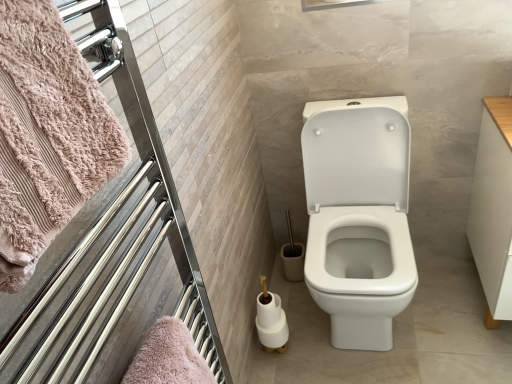
Question: Which direction should I rotate to look at white glossy toilet paper at lower center, which is counted as the first toilet paper, starting from the bottom?

Choices:
 (A) right
 (B) left

Answer: (A)

Question: Can pink fluffy towel at left be found inside chrome metallic towel rack at upper left?

Choices:
 (A) yes
 (B) no

Answer: (A)

Question: Is chrome metallic towel rack at upper left facing away from pink fluffy towel at left?

Choices:
 (A) no
 (B) yes

Answer: (B)

Question: Considering the relative sizes of chrome metallic towel rack at upper left and pink fluffy towel at left in the image provided, is chrome metallic towel rack at upper left smaller than pink fluffy towel at left?

Choices:
 (A) yes
 (B) no

Answer: (B)

Question: Is chrome metallic towel rack at upper left further to camera compared to pink fluffy towel at left?

Choices:
 (A) yes
 (B) no

Answer: (A)

Question: Considering the relative sizes of chrome metallic towel rack at upper left and pink fluffy towel at left in the image provided, is chrome metallic towel rack at upper left thinner than pink fluffy towel at left?

Choices:
 (A) no
 (B) yes

Answer: (B)

Question: Considering the relative sizes of chrome metallic towel rack at upper left and pink fluffy towel at left in the image provided, is chrome metallic towel rack at upper left taller than pink fluffy towel at left?

Choices:
 (A) no
 (B) yes

Answer: (B)

Question: From a real-world perspective, is pink fluffy towel at left physically above chrome metallic towel rack at upper left?

Choices:
 (A) no
 (B) yes

Answer: (B)

Question: Considering the relative sizes of pink fluffy towel at left and chrome metallic towel rack at upper left in the image provided, is pink fluffy towel at left wider than chrome metallic towel rack at upper left?

Choices:
 (A) yes
 (B) no

Answer: (A)

Question: Can you confirm if pink fluffy towel at left is taller than chrome metallic towel rack at upper left?

Choices:
 (A) no
 (B) yes

Answer: (A)

Question: From the image's perspective, is pink fluffy towel at left located beneath chrome metallic towel rack at upper left?

Choices:
 (A) yes
 (B) no

Answer: (B)

Question: Is chrome metallic towel rack at upper left at the back of pink fluffy towel at left?

Choices:
 (A) yes
 (B) no

Answer: (A)

Question: Is pink fluffy towel at left at the left side of chrome metallic towel rack at upper left?

Choices:
 (A) yes
 (B) no

Answer: (A)

Question: Is white wood drawer at right next to chrome metallic towel rack at upper left and touching it?

Choices:
 (A) yes
 (B) no

Answer: (B)